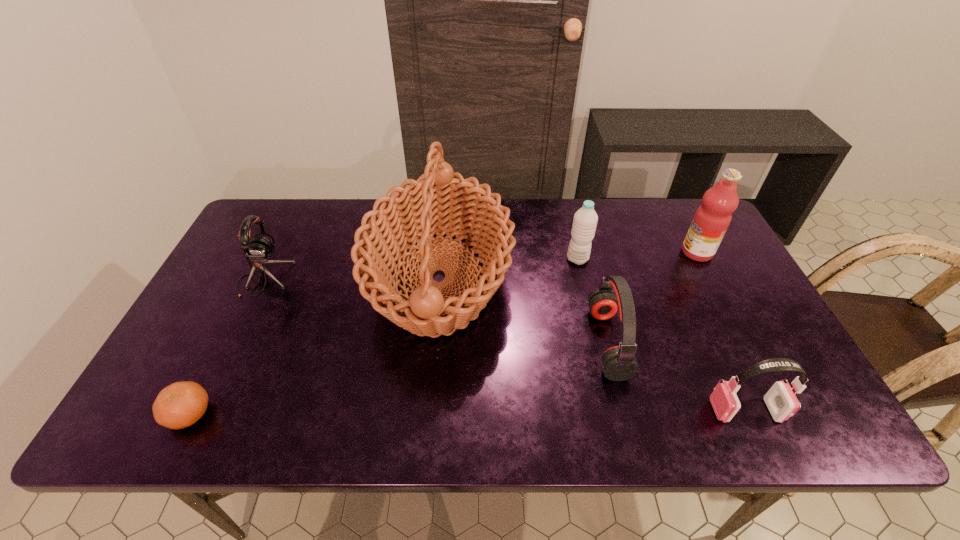
Identify the location of vacant space that is in between the tallest object and the shortest object. The height and width of the screenshot is (540, 960). (315, 347).

Locate an element on the screen. vacant region between the nearest earphone and the second nearest earphone is located at coordinates (677, 376).

The height and width of the screenshot is (540, 960). Find the location of `vacant region between the basket and the fruit juice`. vacant region between the basket and the fruit juice is located at coordinates (568, 266).

Where is `free space between the third object from left to right and the water bottle`? The width and height of the screenshot is (960, 540). free space between the third object from left to right and the water bottle is located at coordinates (509, 269).

Image resolution: width=960 pixels, height=540 pixels. I want to click on free area in between the sixth shortest object and the second earphone from left to right, so click(653, 298).

Point out which object is positioned as the third nearest to the farthest earphone. Please provide its 2D coordinates. Your answer should be formatted as a tuple, i.e. [(x, y)], where the tuple contains the x and y coordinates of a point satisfying the conditions above.

[(585, 220)]

Point out which object is positioned as the fifth nearest to the water bottle. Please provide its 2D coordinates. Your answer should be formatted as a tuple, i.e. [(x, y)], where the tuple contains the x and y coordinates of a point satisfying the conditions above.

[(259, 250)]

Identify the location of earphone that is the nearest to the second tallest object. (619, 363).

You are a GUI agent. You are given a task and a screenshot of the screen. Output one action in this format:
    pyautogui.click(x=<x>, y=<y>)
    Task: Click on the second closest earphone to the rightmost earphone
    Image resolution: width=960 pixels, height=540 pixels.
    Given the screenshot: What is the action you would take?
    pyautogui.click(x=259, y=250)

This screenshot has height=540, width=960. I want to click on free location that satisfies the following two spatial constraints: 1. on the label of the fruit juice; 2. on the front side of the leftmost earphone, so click(711, 279).